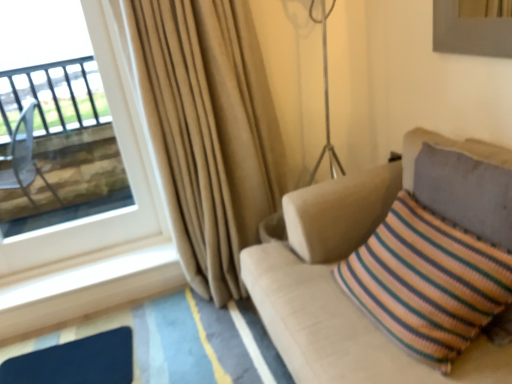
Question: Considering the relative sizes of transparent glass window at upper left and beige fabric curtain at left in the image provided, is transparent glass window at upper left taller than beige fabric curtain at left?

Choices:
 (A) yes
 (B) no

Answer: (B)

Question: Are transparent glass window at upper left and beige fabric curtain at left far apart?

Choices:
 (A) no
 (B) yes

Answer: (A)

Question: Are transparent glass window at upper left and beige fabric curtain at left beside each other?

Choices:
 (A) yes
 (B) no

Answer: (B)

Question: From a real-world perspective, is transparent glass window at upper left over beige fabric curtain at left?

Choices:
 (A) no
 (B) yes

Answer: (B)

Question: Is transparent glass window at upper left positioned before beige fabric curtain at left?

Choices:
 (A) yes
 (B) no

Answer: (B)

Question: From the image's perspective, is transparent glass window at upper left above beige fabric curtain at left?

Choices:
 (A) no
 (B) yes

Answer: (B)

Question: Would you say transparent glass window at upper left is a long distance from beige fabric couch at right?

Choices:
 (A) yes
 (B) no

Answer: (A)

Question: Can you confirm if transparent glass window at upper left is thinner than beige fabric couch at right?

Choices:
 (A) yes
 (B) no

Answer: (A)

Question: Does transparent glass window at upper left have a greater height compared to beige fabric couch at right?

Choices:
 (A) no
 (B) yes

Answer: (B)

Question: Considering the relative sizes of transparent glass window at upper left and beige fabric couch at right in the image provided, is transparent glass window at upper left wider than beige fabric couch at right?

Choices:
 (A) yes
 (B) no

Answer: (B)

Question: From the image's perspective, does transparent glass window at upper left appear higher than beige fabric couch at right?

Choices:
 (A) yes
 (B) no

Answer: (A)

Question: Can you confirm if transparent glass window at upper left is smaller than beige fabric couch at right?

Choices:
 (A) no
 (B) yes

Answer: (B)

Question: Considering the relative sizes of beige fabric couch at right and beige fabric curtain at left in the image provided, is beige fabric couch at right taller than beige fabric curtain at left?

Choices:
 (A) no
 (B) yes

Answer: (A)